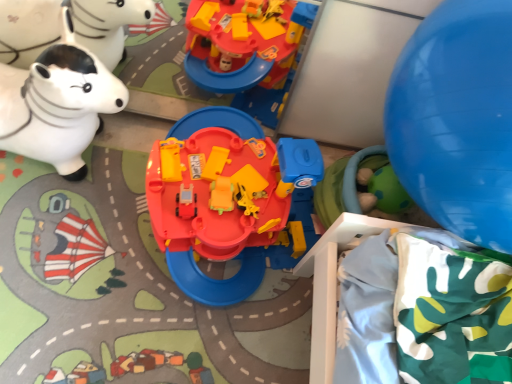
Question: Would you say blue rubber balloon at right is to the left or to the right of matte plastic playset at center, positioned as the second toy in right-to-left order, in the picture?

Choices:
 (A) right
 (B) left

Answer: (A)

Question: From the image's perspective, relative to matte plastic playset at center, which ranks as the 2th toy in left-to-right order, is blue rubber balloon at right above or below?

Choices:
 (A) above
 (B) below

Answer: (A)

Question: Based on their relative distances, which object is farther from the green rubber ball at lower right, which is the first toy from right to left?

Choices:
 (A) white glossy rocking horse at left, arranged as the third toy when viewed from the right
 (B) matte plastic playset at center, positioned as the second toy in right-to-left order
 (C) blue rubber balloon at right

Answer: (A)

Question: Which is nearer to the green rubber ball at lower right, positioned as the third toy in left-to-right order?

Choices:
 (A) white glossy rocking horse at left, arranged as the third toy when viewed from the right
 (B) blue rubber balloon at right
 (C) matte plastic playset at center, positioned as the second toy in right-to-left order

Answer: (C)